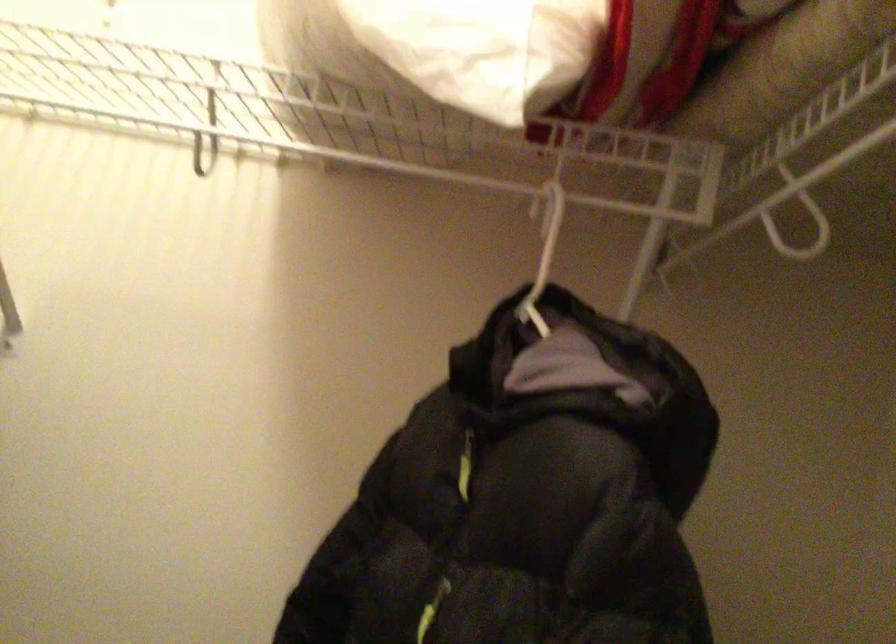
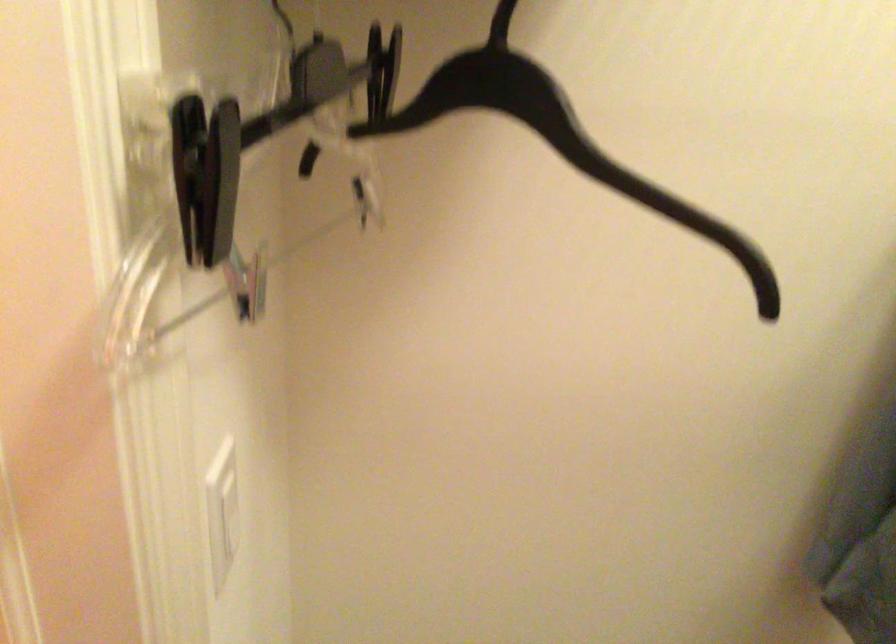
Question: Which direction would the cameraman need to move to produce the second image? Reply with the corresponding letter.

Choices:
 (A) Left
 (B) Right
 (C) Forward
 (D) Backward

Answer: (A)